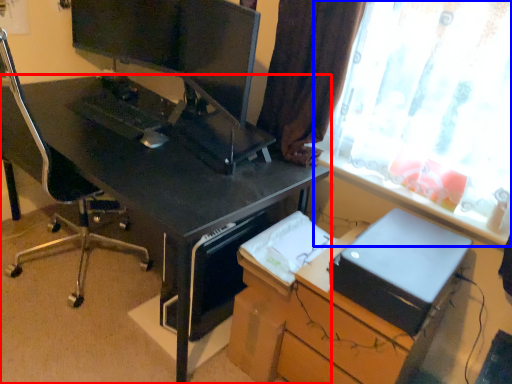
Question: Which point is further to the camera, desk (highlighted by a red box) or window (highlighted by a blue box)?

Choices:
 (A) desk
 (B) window

Answer: (A)